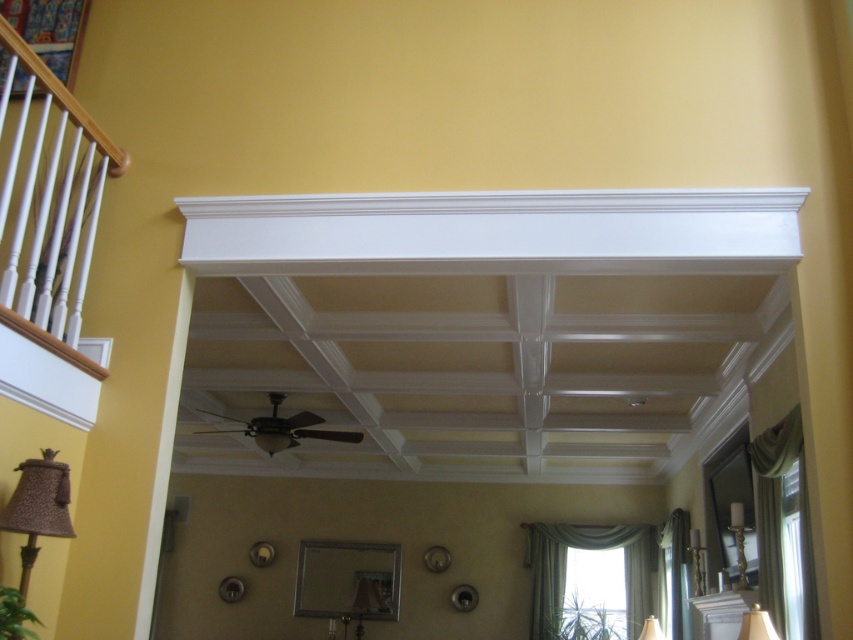
Does white fabric lampshade at lower right lie in front of matte white lampshade at lower right?

That is True.

Between white fabric lampshade at lower right and matte white lampshade at lower right, which one has more height?

matte white lampshade at lower right

Who is more distant from viewer, (740, 636) or (648, 636)?

Point (648, 636)

You are a GUI agent. You are given a task and a screenshot of the screen. Output one action in this format:
    pyautogui.click(x=<x>, y=<y>)
    Task: Click on the white fabric lampshade at lower right
    Image resolution: width=853 pixels, height=640 pixels.
    Given the screenshot: What is the action you would take?
    pyautogui.click(x=756, y=625)